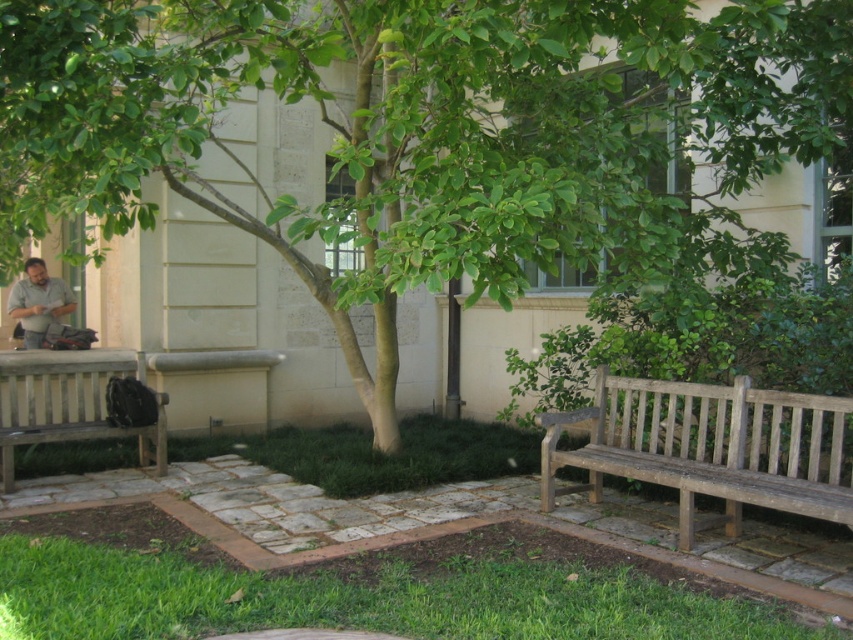
Which of these two, weathered wood bench at lower right or matte gray shirt at left, stands shorter?

matte gray shirt at left is shorter.

Is weathered wood bench at lower right smaller than matte gray shirt at left?

No, weathered wood bench at lower right is not smaller than matte gray shirt at left.

The height and width of the screenshot is (640, 853). What are the coordinates of `weathered wood bench at lower right` in the screenshot? It's located at (711, 448).

Is weathered wood bench at lower right taller than wooden bench at left?

Yes, weathered wood bench at lower right is taller than wooden bench at left.

Can you confirm if weathered wood bench at lower right is shorter than wooden bench at left?

Incorrect, weathered wood bench at lower right's height does not fall short of wooden bench at left's.

Identify the location of weathered wood bench at lower right. The image size is (853, 640). (711, 448).

I want to click on weathered wood bench at lower right, so click(x=711, y=448).

Which is in front, point (378, 0) or point (4, 451)?

Point (378, 0) is in front.

This screenshot has height=640, width=853. Describe the element at coordinates (425, 131) in the screenshot. I see `green leafy tree at center` at that location.

The height and width of the screenshot is (640, 853). Find the location of `green leafy tree at center`. green leafy tree at center is located at coordinates (425, 131).